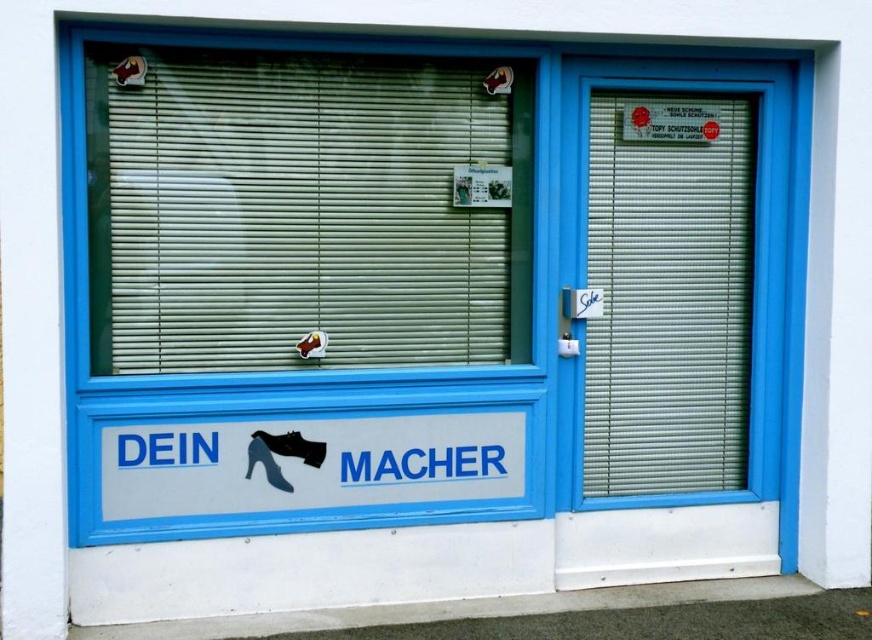
Is point (336, 308) positioned in front of point (698, 116)?

Yes, it is.

Measure the distance between green matte blinds at center and camera.

They are 3.13 meters apart.

You are a GUI agent. You are given a task and a screenshot of the screen. Output one action in this format:
    pyautogui.click(x=<x>, y=<y>)
    Task: Click on the green matte blinds at center
    The image size is (872, 640).
    Given the screenshot: What is the action you would take?
    pyautogui.click(x=308, y=211)

Where is `green matte blinds at center`? This screenshot has height=640, width=872. green matte blinds at center is located at coordinates (308, 211).